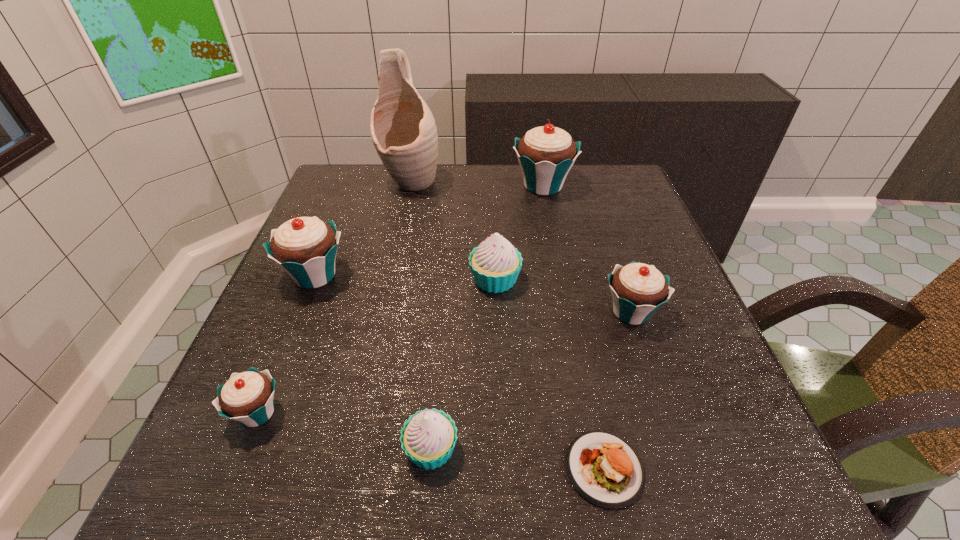
I want to click on pitcher positioned at the far edge, so click(x=403, y=130).

At what (x,y) coordinates should I click in order to perform the action: click on cupcake that is at the far edge. Please return your answer as a coordinate pair (x, y). The height and width of the screenshot is (540, 960). Looking at the image, I should click on (546, 154).

You are a GUI agent. You are given a task and a screenshot of the screen. Output one action in this format:
    pyautogui.click(x=<x>, y=<y>)
    Task: Click on the cupcake located in the near edge section of the desktop
    The height and width of the screenshot is (540, 960).
    Given the screenshot: What is the action you would take?
    pos(428,438)

The width and height of the screenshot is (960, 540). In order to click on patty (food) positioned at the near edge in this screenshot , I will do `click(606, 470)`.

Where is `pitcher that is at the left edge`? The image size is (960, 540). pitcher that is at the left edge is located at coordinates (403, 130).

Locate an element on the screen. Image resolution: width=960 pixels, height=540 pixels. object at the far left corner is located at coordinates (403, 130).

This screenshot has height=540, width=960. Find the location of `object present at the far right corner`. object present at the far right corner is located at coordinates (546, 154).

This screenshot has height=540, width=960. In the image, there is a desktop. Find the location of `vacant space at the far edge`. vacant space at the far edge is located at coordinates (575, 206).

Where is `vacant space at the near edge`? vacant space at the near edge is located at coordinates (531, 504).

What are the coordinates of `free space at the left edge of the desktop` in the screenshot? It's located at (351, 258).